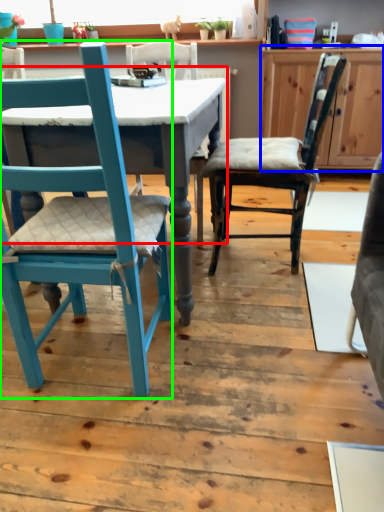
Question: Estimate the real-world distances between objects in this image. Which object is closer to table (highlighted by a red box), cabinetry (highlighted by a blue box) or chair (highlighted by a green box)?

Choices:
 (A) cabinetry
 (B) chair

Answer: (B)